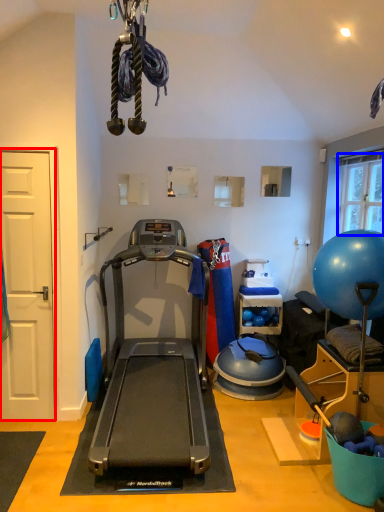
Question: Which point is further to the camera, door (highlighted by a red box) or window screen (highlighted by a blue box)?

Choices:
 (A) door
 (B) window screen

Answer: (B)